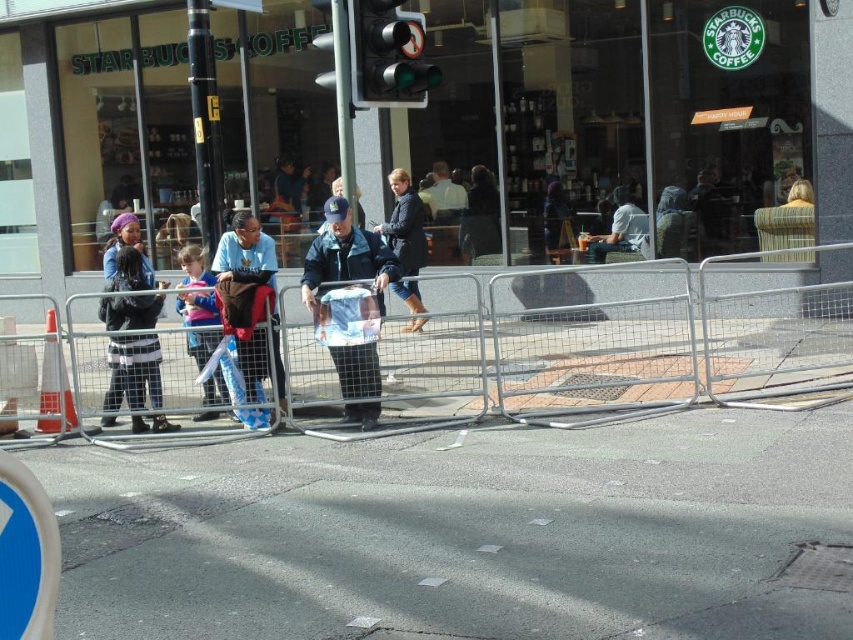
You are a pedestrian walking towards the Starbucks Coffee shop and see the blue denim jacket at center and the black leather jacket at left. Which jacket is closer to the storefront entrance?

The black leather jacket at left is closer to the storefront entrance because it is positioned to the left of the blue denim jacket at center, which is further to the right.

You are a delivery person trying to navigate through the street scene outside the Starbucks Coffee shop. You need to place a large package on the ground. Which object between the gray asphalt pavement at center and the black leather jacket at left would be a suitable surface for placing the package?

The gray asphalt pavement at center is not as tall as the black leather jacket at left, so the gray asphalt pavement at center would be a suitable surface for placing the large package since it is lower and more stable compared to the jacket.

In the scene shown: You are a photographer trying to capture a clear shot of the Starbucks logo on the upper right corner of the window. There are two jackets blocking your view slightly. Which jacket should you move first to get a clearer shot, the blue denim jacket at center or the black leather jacket at left?

The blue denim jacket at center is wider than the black leather jacket at left, so moving the blue denim jacket at center first would likely provide a clearer view of the Starbucks logo.